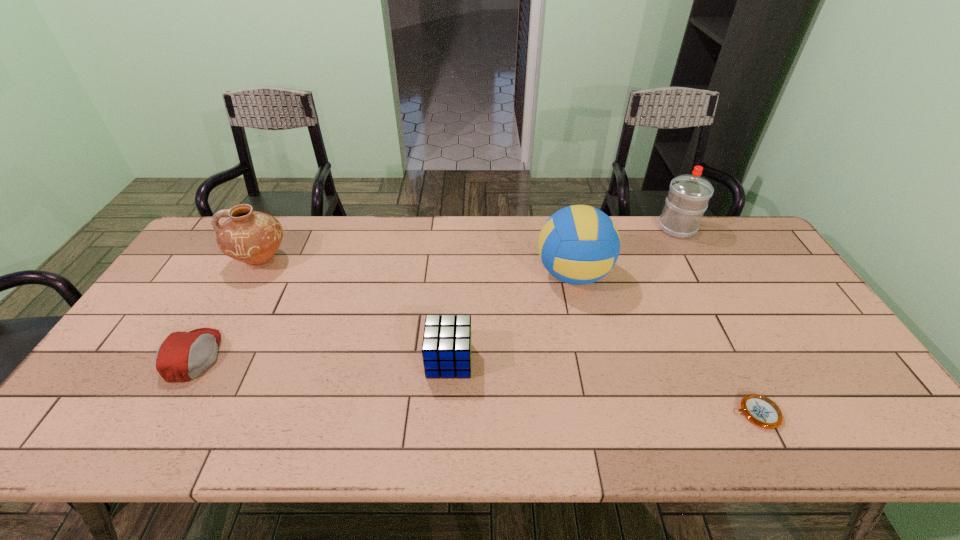
Where is `water bottle`? water bottle is located at coordinates (689, 194).

Where is `the third object from right to left`? the third object from right to left is located at coordinates (579, 244).

This screenshot has height=540, width=960. Find the location of `the fourth shortest object`. the fourth shortest object is located at coordinates (252, 237).

Find the location of `cube`. cube is located at coordinates (446, 349).

I want to click on the fourth tallest object, so click(x=446, y=349).

Locate an element on the screen. The width and height of the screenshot is (960, 540). cap is located at coordinates (182, 356).

At what (x,y) coordinates should I click in order to perform the action: click on compass. Please return your answer as a coordinate pair (x, y). Looking at the image, I should click on (760, 410).

Where is `the nearest object`? the nearest object is located at coordinates (760, 410).

Where is `vacant space positioned 0.240m on the left of the third object from right to left`? vacant space positioned 0.240m on the left of the third object from right to left is located at coordinates (458, 274).

This screenshot has height=540, width=960. Identify the location of vacant space positioned on the side of the pottery with the handle. (217, 261).